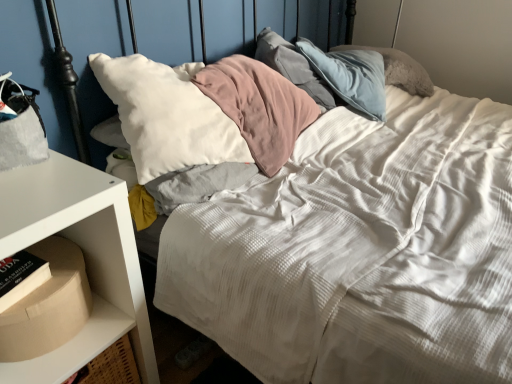
This screenshot has width=512, height=384. What are the coordinates of `free point above white matte nightstand at left (from a real-world perspective)` in the screenshot? It's located at (41, 177).